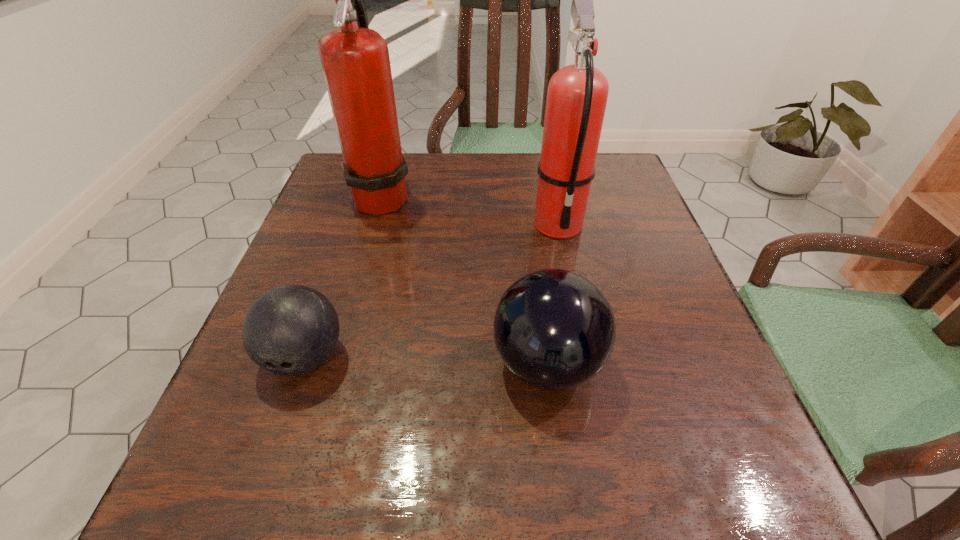
Identify the location of vacant space at the right edge of the desktop. Image resolution: width=960 pixels, height=540 pixels. (631, 341).

The image size is (960, 540). What are the coordinates of `free space at the far left corner of the desktop` in the screenshot? It's located at (322, 188).

This screenshot has width=960, height=540. I want to click on free spot at the near left corner of the desktop, so click(x=252, y=471).

The height and width of the screenshot is (540, 960). In the image, there is a desktop. Find the location of `free region at the far right corner`. free region at the far right corner is located at coordinates (628, 198).

I want to click on vacant space at the near right corner, so click(x=756, y=490).

Identify the location of free point between the left fire extinguisher and the shorter bowling ball. Image resolution: width=960 pixels, height=540 pixels. (344, 276).

Where is `free space between the left bowling ball and the right fire extinguisher`? This screenshot has height=540, width=960. free space between the left bowling ball and the right fire extinguisher is located at coordinates (431, 290).

Locate an element on the screen. free point between the left bowling ball and the right fire extinguisher is located at coordinates (431, 290).

Identify the location of empty space that is in between the shorter bowling ball and the right fire extinguisher. (431, 290).

The width and height of the screenshot is (960, 540). What are the coordinates of `vacant space that's between the left bowling ball and the left fire extinguisher` in the screenshot? It's located at (344, 276).